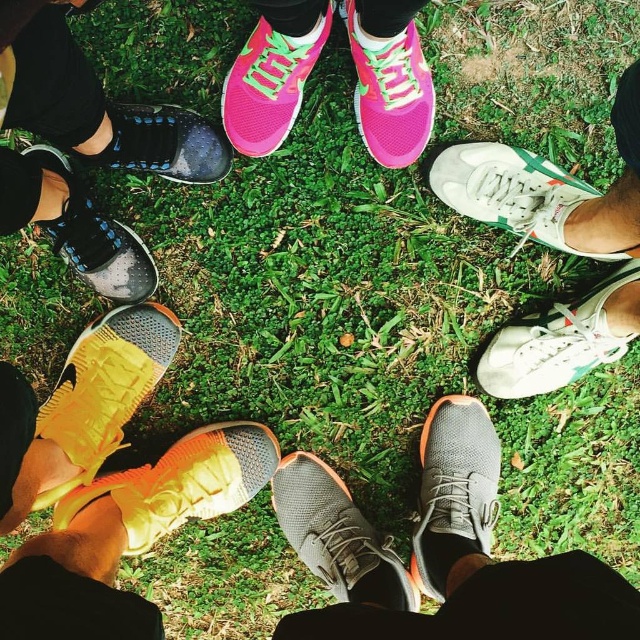
Question: Which point is closer to the camera?

Choices:
 (A) (428, 129)
 (B) (307, 545)
 (C) (61, 515)
 (D) (513, 396)

Answer: (C)

Question: Considering the real-world distances, which object is farthest from the white canvas shoe at lower right?

Choices:
 (A) pink mesh sneakers at upper center
 (B) shiny orange sneaker at lower left
 (C) pink mesh shoe at upper center
 (D) matte black shoe at lower left

Answer: (D)

Question: Does matte black shoe at left have a smaller size compared to matte black shoe at lower left?

Choices:
 (A) no
 (B) yes

Answer: (A)

Question: Is matte black shoe at left above white canvas shoe at lower right?

Choices:
 (A) yes
 (B) no

Answer: (A)

Question: Does matte black shoe at left have a smaller size compared to shiny orange sneaker at lower left?

Choices:
 (A) no
 (B) yes

Answer: (A)

Question: Among these points, which one is farthest from the camera?

Choices:
 (A) (92, 211)
 (B) (362, 40)
 (C) (467, 451)

Answer: (C)